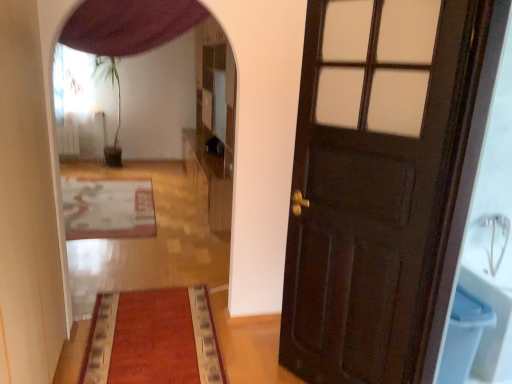
Question: From a real-world perspective, is wooden dresser at center on velvet red mat at center, the second mat positioned from the back?

Choices:
 (A) no
 (B) yes

Answer: (B)

Question: Is the position of wooden dresser at center more distant than that of velvet red mat at center, the 1th mat positioned from the bottom?

Choices:
 (A) yes
 (B) no

Answer: (A)

Question: Considering the relative positions of wooden dresser at center and velvet red mat at center, the 1th mat positioned from the bottom, in the image provided, is wooden dresser at center to the left of velvet red mat at center, the 1th mat positioned from the bottom, from the viewer's perspective?

Choices:
 (A) yes
 (B) no

Answer: (B)

Question: Is wooden dresser at center far away from velvet red mat at center, the second mat positioned from the back?

Choices:
 (A) yes
 (B) no

Answer: (A)

Question: Can you confirm if wooden dresser at center is wider than velvet red mat at center, the second mat when ordered from top to bottom?

Choices:
 (A) yes
 (B) no

Answer: (B)

Question: Looking at the image, does white textured rug at center, which is counted as the 1th mat, starting from the back, seem bigger or smaller compared to purple fabric curtain at upper center?

Choices:
 (A) big
 (B) small

Answer: (A)

Question: Is point (117, 223) closer or farther from the camera than point (81, 16)?

Choices:
 (A) closer
 (B) farther

Answer: (B)

Question: Is white textured rug at center, acting as the first mat starting from the top, situated inside purple fabric curtain at upper center or outside?

Choices:
 (A) inside
 (B) outside

Answer: (B)

Question: From a real-world perspective, is white textured rug at center, acting as the 1th mat starting from the left, above or below purple fabric curtain at upper center?

Choices:
 (A) below
 (B) above

Answer: (A)

Question: Is velvet red mat at center, which is the 1th mat in front-to-back order, taller or shorter than dark wood door at right?

Choices:
 (A) short
 (B) tall

Answer: (A)

Question: Considering the positions of velvet red mat at center, the 1th mat positioned from the bottom, and dark wood door at right in the image, is velvet red mat at center, the 1th mat positioned from the bottom, bigger or smaller than dark wood door at right?

Choices:
 (A) small
 (B) big

Answer: (A)

Question: Visually, is velvet red mat at center, the 1th mat positioned from the bottom, positioned to the left or to the right of dark wood door at right?

Choices:
 (A) right
 (B) left

Answer: (B)

Question: Relative to dark wood door at right, is velvet red mat at center, positioned as the first mat in right-to-left order, in front or behind?

Choices:
 (A) behind
 (B) front

Answer: (A)

Question: From the image's perspective, is velvet red mat at center, the second mat positioned from the back, positioned above or below wooden floor mat at center?

Choices:
 (A) below
 (B) above

Answer: (A)

Question: Is velvet red mat at center, which is counted as the 2th mat, starting from the left, wider or thinner than wooden floor mat at center?

Choices:
 (A) wide
 (B) thin

Answer: (B)